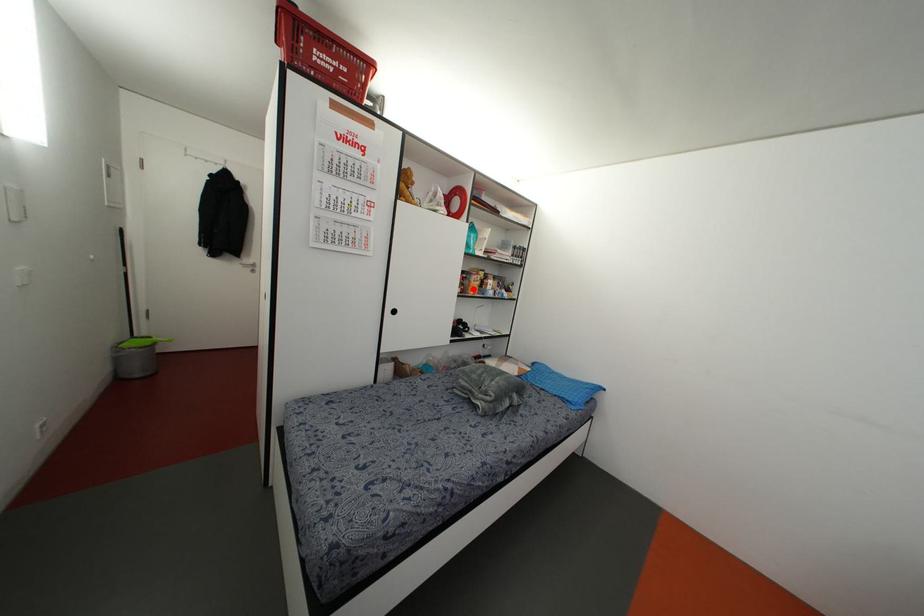
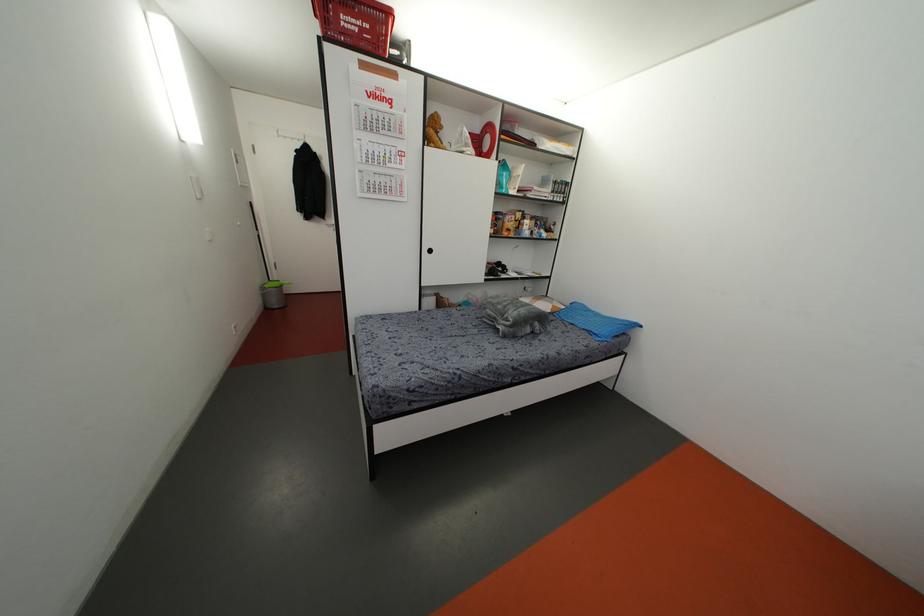
In the second image, find the point that corresponds to the highlighted location in the first image.

(507, 229)